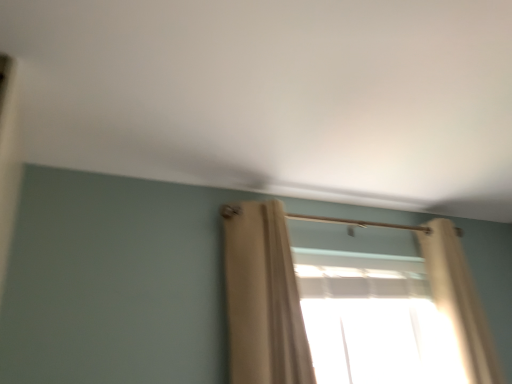
Identify the location of beige fabric curtain at center, placed as the second curtain when sorted from right to left. The image size is (512, 384). (x=263, y=297).

What do you see at coordinates (459, 300) in the screenshot?
I see `beige sheer curtain at right, the 1th curtain in the right-to-left sequence` at bounding box center [459, 300].

Image resolution: width=512 pixels, height=384 pixels. What are the coordinates of `beige fabric curtain at center, which is the first curtain in left-to-right order` in the screenshot? It's located at (263, 297).

Is beige sheer curtain at right, the 1th curtain in the right-to-left sequence, not within beige fabric curtain at center, placed as the second curtain when sorted from right to left?

Indeed, beige sheer curtain at right, the 1th curtain in the right-to-left sequence, is completely outside beige fabric curtain at center, placed as the second curtain when sorted from right to left.

From a real-world perspective, is beige sheer curtain at right, the second curtain when ordered from left to right, positioned above or below beige fabric curtain at center, which is the first curtain in left-to-right order?

From a real-world perspective, beige sheer curtain at right, the second curtain when ordered from left to right, is physically below beige fabric curtain at center, which is the first curtain in left-to-right order.

Does point (448, 314) come behind point (281, 338)?

That is True.

How much distance is there between translucent fabric at center and beige sheer curtain at right, the second curtain when ordered from left to right?

They are 14.94 inches apart.

Between translucent fabric at center and beige sheer curtain at right, the 1th curtain in the right-to-left sequence, which one has less height?

translucent fabric at center is shorter.

Can you see translucent fabric at center touching beige sheer curtain at right, the second curtain when ordered from left to right?

translucent fabric at center is not next to beige sheer curtain at right, the second curtain when ordered from left to right, and they're not touching.

Would you say beige sheer curtain at right, the second curtain when ordered from left to right, is part of translucent fabric at center's contents?

No, beige sheer curtain at right, the second curtain when ordered from left to right, is not surrounded by translucent fabric at center.

Considering the positions of objects beige fabric curtain at center, placed as the second curtain when sorted from right to left, and beige sheer curtain at right, the second curtain when ordered from left to right, in the image provided, who is in front, beige fabric curtain at center, placed as the second curtain when sorted from right to left, or beige sheer curtain at right, the second curtain when ordered from left to right,?

beige fabric curtain at center, placed as the second curtain when sorted from right to left, is closer to the camera.

Based on the photo, from a real-world perspective, is beige fabric curtain at center, which is the first curtain in left-to-right order, positioned above or below beige sheer curtain at right, the second curtain when ordered from left to right?

From a real-world perspective, beige fabric curtain at center, which is the first curtain in left-to-right order, is physically above beige sheer curtain at right, the second curtain when ordered from left to right.

Is beige fabric curtain at center, which is the first curtain in left-to-right order, shorter than beige sheer curtain at right, the second curtain when ordered from left to right?

Yes, beige fabric curtain at center, which is the first curtain in left-to-right order, is shorter than beige sheer curtain at right, the second curtain when ordered from left to right.

Where is `curtain above the beige sheer curtain at right, the 1th curtain in the right-to-left sequence (from a real-world perspective)`? curtain above the beige sheer curtain at right, the 1th curtain in the right-to-left sequence (from a real-world perspective) is located at coordinates (263, 297).

Measure the distance from translucent fabric at center to beige fabric curtain at center, placed as the second curtain when sorted from right to left.

They are 24.29 inches apart.

From a real-world perspective, is translucent fabric at center on top of beige fabric curtain at center, which is the first curtain in left-to-right order?

Incorrect, from a real-world perspective, translucent fabric at center is lower than beige fabric curtain at center, which is the first curtain in left-to-right order.

Is translucent fabric at center turned away from beige fabric curtain at center, placed as the second curtain when sorted from right to left?

translucent fabric at center is not turned away from beige fabric curtain at center, placed as the second curtain when sorted from right to left.

From the image's perspective, starting from the translucent fabric at center, which curtain is the 2nd one above? Please provide its 2D coordinates.

[(263, 297)]

Is point (464, 344) behind point (412, 310)?

No, (464, 344) is in front of (412, 310).

Based on their positions, is beige sheer curtain at right, the 1th curtain in the right-to-left sequence, located to the left or right of translucent fabric at center?

Based on their positions, beige sheer curtain at right, the 1th curtain in the right-to-left sequence, is located to the right of translucent fabric at center.

Considering the sizes of beige sheer curtain at right, the second curtain when ordered from left to right, and translucent fabric at center in the image, is beige sheer curtain at right, the second curtain when ordered from left to right, wider or thinner than translucent fabric at center?

In the image, beige sheer curtain at right, the second curtain when ordered from left to right, appears to be wider than translucent fabric at center.

Considering the relative positions of beige sheer curtain at right, the 1th curtain in the right-to-left sequence, and translucent fabric at center in the image provided, is beige sheer curtain at right, the 1th curtain in the right-to-left sequence, in front of translucent fabric at center?

Yes, it is.

Does beige fabric curtain at center, which is the first curtain in left-to-right order, turn towards translucent fabric at center?

No, beige fabric curtain at center, which is the first curtain in left-to-right order, is not aimed at translucent fabric at center.

Does beige fabric curtain at center, which is the first curtain in left-to-right order, touch translucent fabric at center?

No, beige fabric curtain at center, which is the first curtain in left-to-right order, is not next to translucent fabric at center.

Considering the relative sizes of beige fabric curtain at center, which is the first curtain in left-to-right order, and translucent fabric at center in the image provided, is beige fabric curtain at center, which is the first curtain in left-to-right order, wider than translucent fabric at center?

No, beige fabric curtain at center, which is the first curtain in left-to-right order, is not wider than translucent fabric at center.

The image size is (512, 384). Identify the location of curtain below the beige fabric curtain at center, placed as the second curtain when sorted from right to left (from the image's perspective). (459, 300).

Where is `window that appears behind the beige sheer curtain at right, the second curtain when ordered from left to right`? The height and width of the screenshot is (384, 512). window that appears behind the beige sheer curtain at right, the second curtain when ordered from left to right is located at coordinates tap(373, 319).

Looking at the image, which one is located closer to beige sheer curtain at right, the second curtain when ordered from left to right, beige fabric curtain at center, placed as the second curtain when sorted from right to left, or translucent fabric at center?

translucent fabric at center.

Based on their spatial positions, is translucent fabric at center or beige sheer curtain at right, the 1th curtain in the right-to-left sequence, further from beige fabric curtain at center, placed as the second curtain when sorted from right to left?

beige sheer curtain at right, the 1th curtain in the right-to-left sequence, is positioned further to the anchor beige fabric curtain at center, placed as the second curtain when sorted from right to left.

From the image, which object appears to be farther from beige sheer curtain at right, the second curtain when ordered from left to right, translucent fabric at center or beige fabric curtain at center, which is the first curtain in left-to-right order?

beige fabric curtain at center, which is the first curtain in left-to-right order, is further to beige sheer curtain at right, the second curtain when ordered from left to right.

Looking at the image, which one is located closer to translucent fabric at center, beige sheer curtain at right, the second curtain when ordered from left to right, or beige fabric curtain at center, placed as the second curtain when sorted from right to left?

beige sheer curtain at right, the second curtain when ordered from left to right, is positioned closer to the anchor translucent fabric at center.

From the image, which object appears to be nearer to beige fabric curtain at center, placed as the second curtain when sorted from right to left, beige sheer curtain at right, the second curtain when ordered from left to right, or translucent fabric at center?

translucent fabric at center lies closer to beige fabric curtain at center, placed as the second curtain when sorted from right to left, than the other object.

From the image, which object appears to be farther from translucent fabric at center, beige fabric curtain at center, which is the first curtain in left-to-right order, or beige sheer curtain at right, the second curtain when ordered from left to right?

The object further to translucent fabric at center is beige fabric curtain at center, which is the first curtain in left-to-right order.

Where is `window situated between beige fabric curtain at center, which is the first curtain in left-to-right order, and beige sheer curtain at right, the 1th curtain in the right-to-left sequence, from left to right`? window situated between beige fabric curtain at center, which is the first curtain in left-to-right order, and beige sheer curtain at right, the 1th curtain in the right-to-left sequence, from left to right is located at coordinates (373, 319).